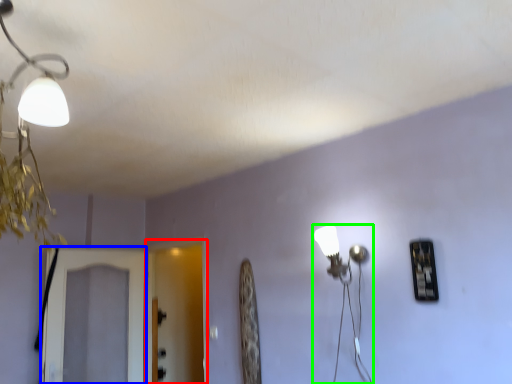
Question: Considering the real-world distances, which object is closest to screen door (highlighted by a red box)? screen door (highlighted by a blue box) or lamp (highlighted by a green box).

Choices:
 (A) screen door
 (B) lamp

Answer: (A)